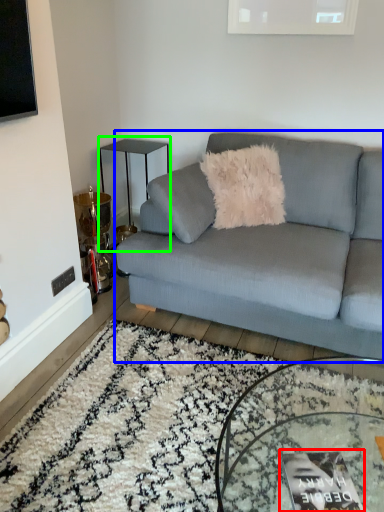
Question: Which object is the farthest from magazine (highlighted by a red box)? Choose among these: studio couch (highlighted by a blue box) or table (highlighted by a green box).

Choices:
 (A) studio couch
 (B) table

Answer: (B)